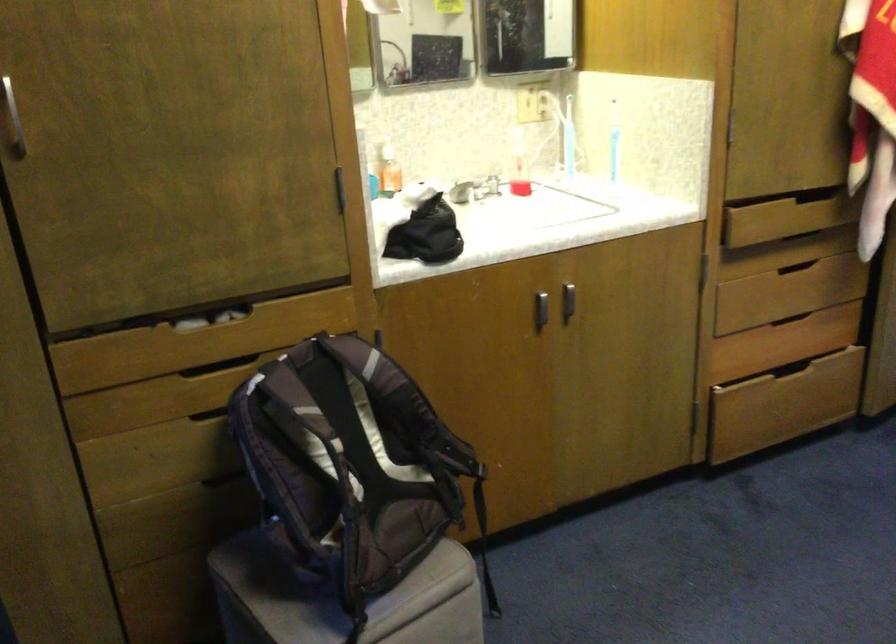
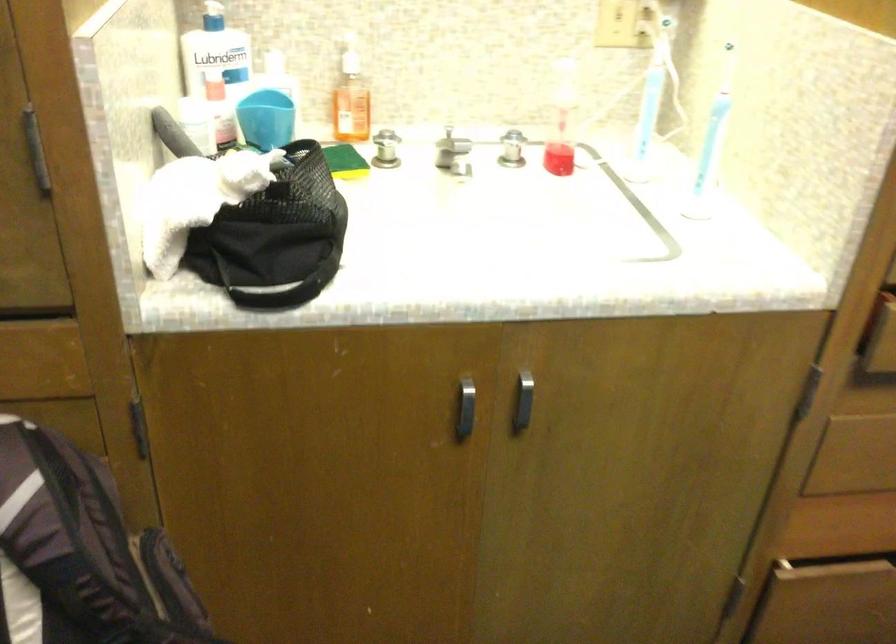
Find the pixel in the second image that matches (540,306) in the first image.

(464, 409)